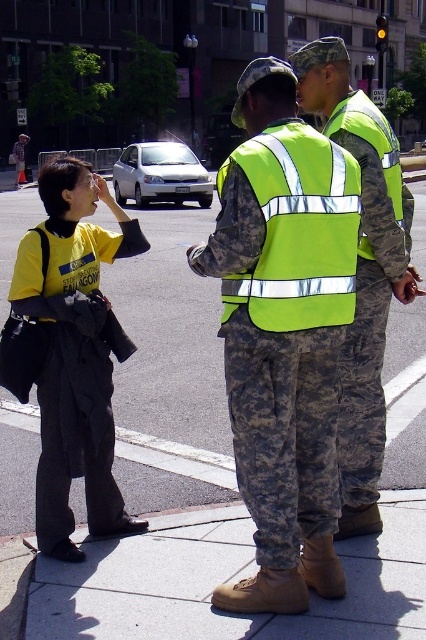
Question: Which object is closer to the camera taking this photo?

Choices:
 (A) yellow reflective vest at center
 (B) high-visibility fabric safety vest at center

Answer: (B)

Question: From the image, what is the correct spatial relationship of yellow reflective vest at center in relation to neon yellow reflective vest at center?

Choices:
 (A) right
 (B) left

Answer: (B)

Question: Which point is farther to the camera?

Choices:
 (A) yellow reflective vest at center
 (B) gray concrete pavement at center

Answer: (B)

Question: Is yellow reflective vest at center to the right of high-visibility fabric safety vest at center from the viewer's perspective?

Choices:
 (A) yes
 (B) no

Answer: (B)

Question: Which of the following is the closest to the observer?

Choices:
 (A) (238, 285)
 (B) (270, 237)

Answer: (B)

Question: Can you confirm if gray concrete pavement at center is positioned to the right of neon yellow reflective vest at center?

Choices:
 (A) no
 (B) yes

Answer: (A)